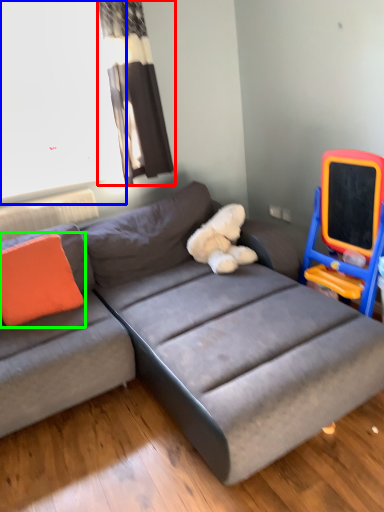
Question: Which object is the closest to the curtain (highlighted by a red box)? Choose among these: window screen (highlighted by a blue box) or pillow (highlighted by a green box).

Choices:
 (A) window screen
 (B) pillow

Answer: (A)